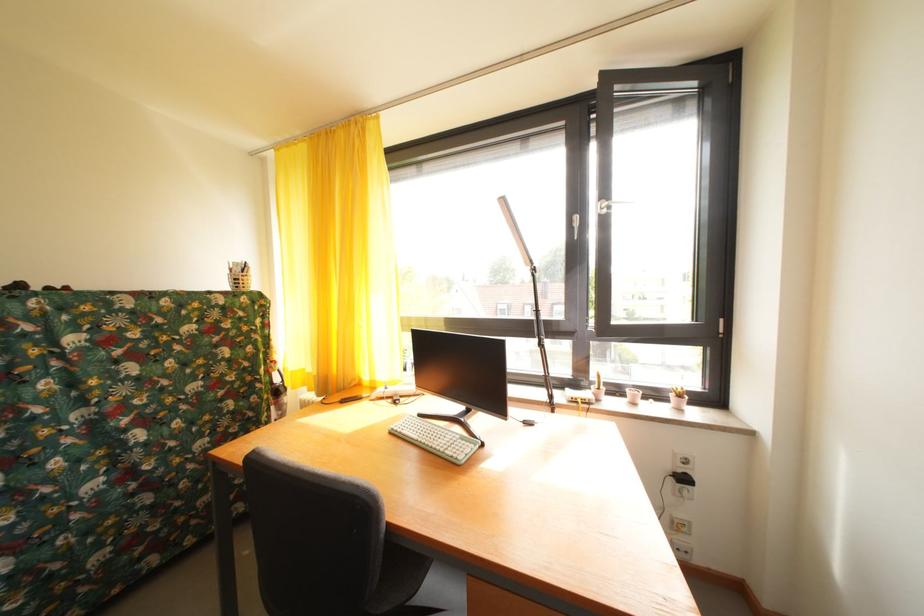
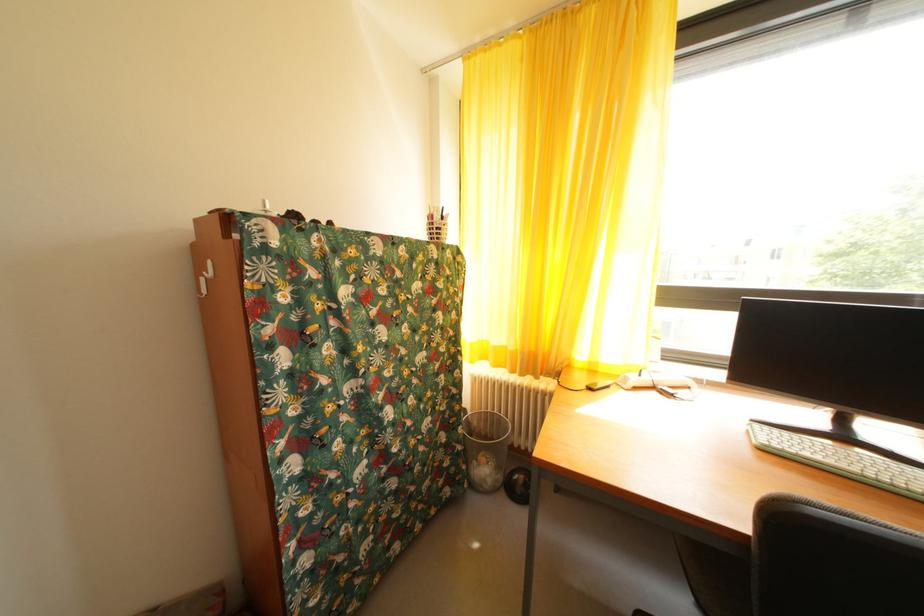
Question: The images are taken continuously from a first-person perspective. In which direction are you moving?

Choices:
 (A) Left
 (B) Right
 (C) Forward
 (D) Backward

Answer: (A)